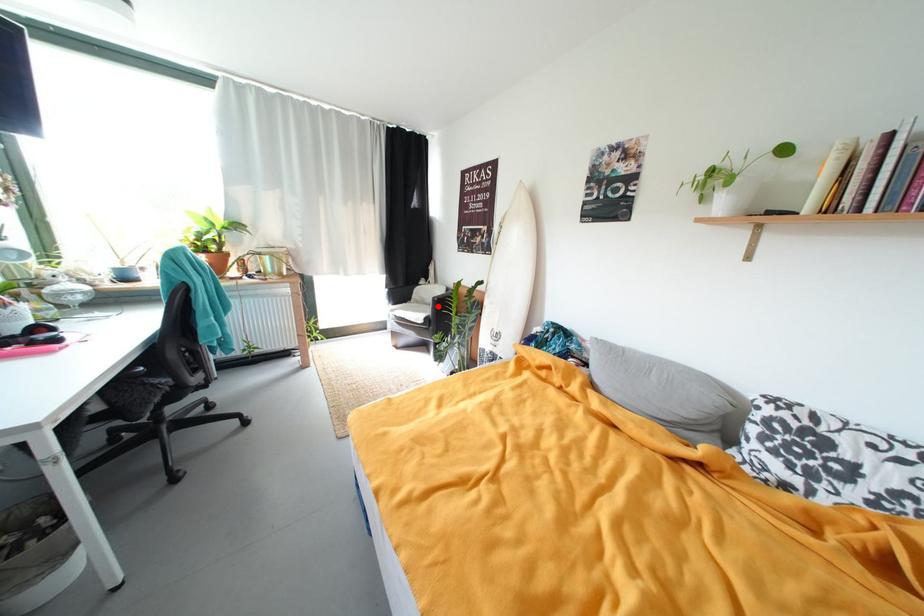
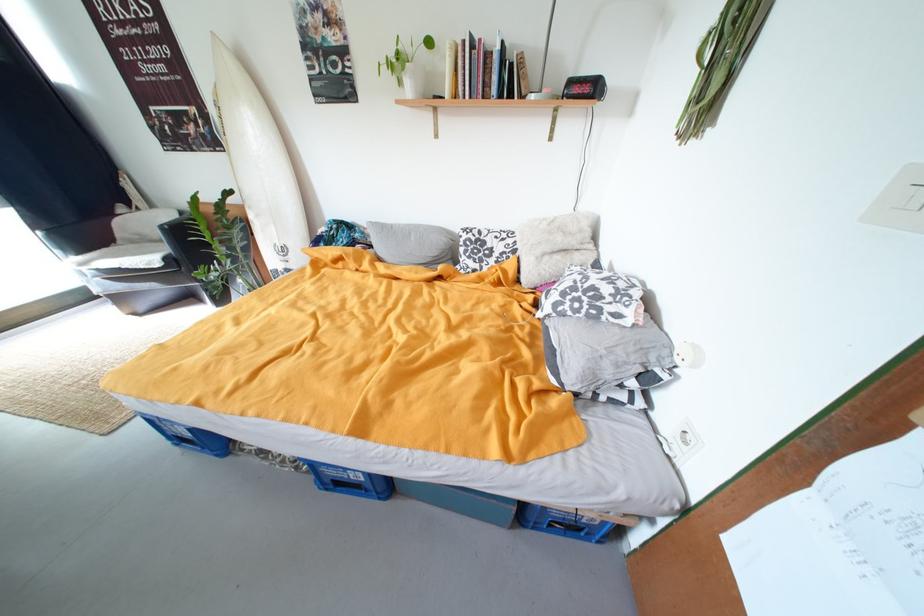
Question: I am providing you with two images of the same scene from different viewpoints. A red point is shown in image1. For the corresponding object point in image2, is it positioned nearer or farther from the camera?

Choices:
 (A) Nearer
 (B) Farther

Answer: (A)